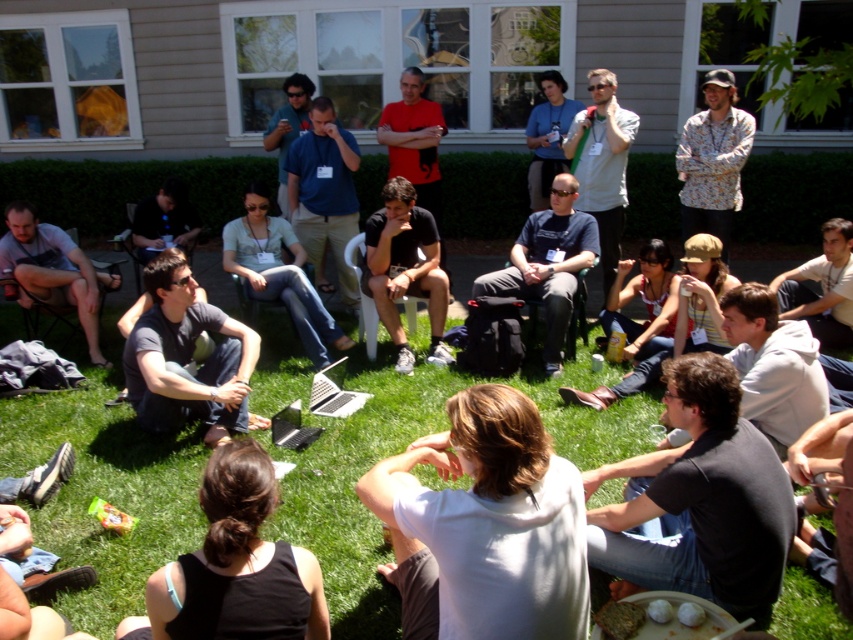
From the picture: You are organizing a photo shoot and need to ensure all participants are visible in the frame. Given the positions of the matte gray shirt at lower left and the matte blue shirt at upper center, which participant should you adjust to avoid being cropped out?

The matte gray shirt at lower left occupies less space than the matte blue shirt at upper center, so you should adjust the matte gray shirt at lower left to ensure it is fully visible in the frame.

You are organizing a group photo and want to arrange the participants by shirt size from smallest to largest. Given the white cotton shirt at center and the matte gray shirt at lower left, which shirt should be placed first in the sequence?

The white cotton shirt at center should be placed first in the sequence because it is smaller than the matte gray shirt at lower left.